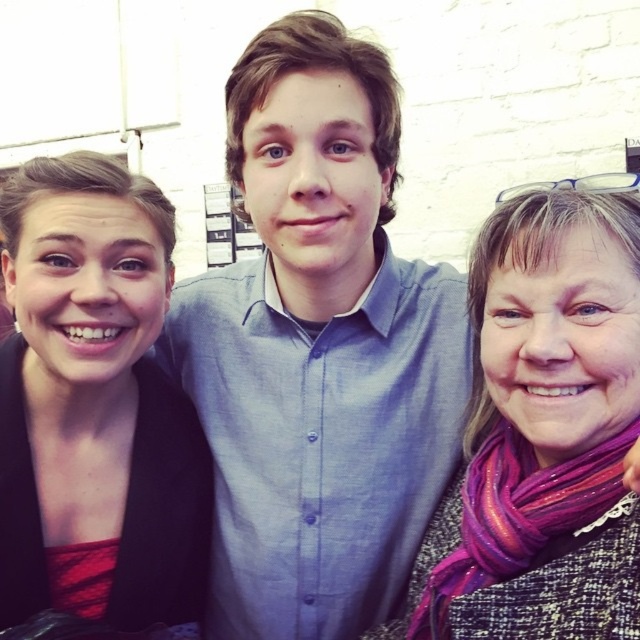
Question: Is blue cotton shirt at center thinner than matte black jacket at left?

Choices:
 (A) yes
 (B) no

Answer: (B)

Question: Among these objects, which one is nearest to the camera?

Choices:
 (A) purple glitter scarf at center
 (B) matte black jacket at left
 (C) blue cotton shirt at center

Answer: (A)

Question: Which object is positioned farthest from the blue cotton shirt at center?

Choices:
 (A) purple glitter scarf at center
 (B) matte black jacket at left

Answer: (A)

Question: Does blue cotton shirt at center have a lesser width compared to purple glitter scarf at center?

Choices:
 (A) no
 (B) yes

Answer: (A)

Question: Among these points, which one is nearest to the camera?

Choices:
 (A) (148, 256)
 (B) (289, 627)

Answer: (A)

Question: Is blue cotton shirt at center wider than matte black jacket at left?

Choices:
 (A) yes
 (B) no

Answer: (A)